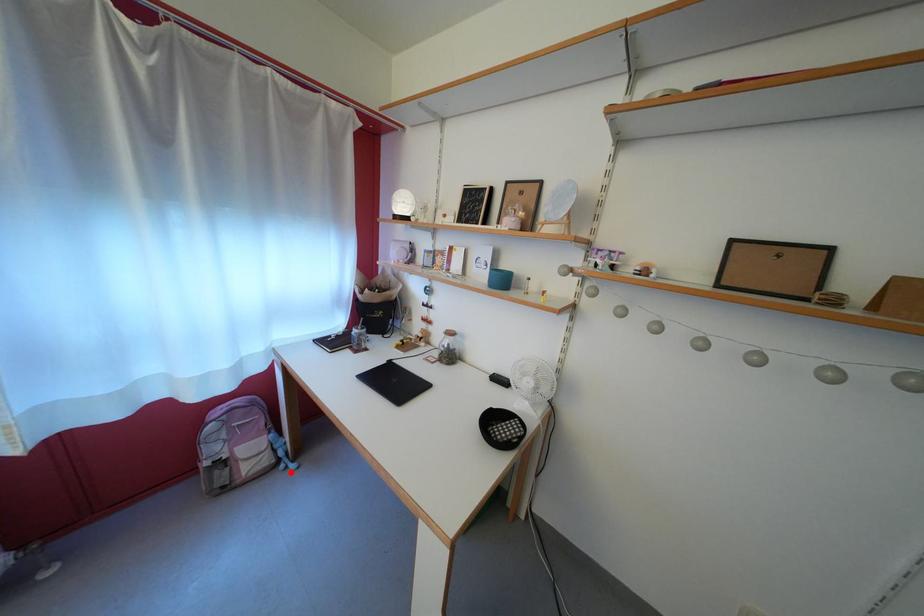
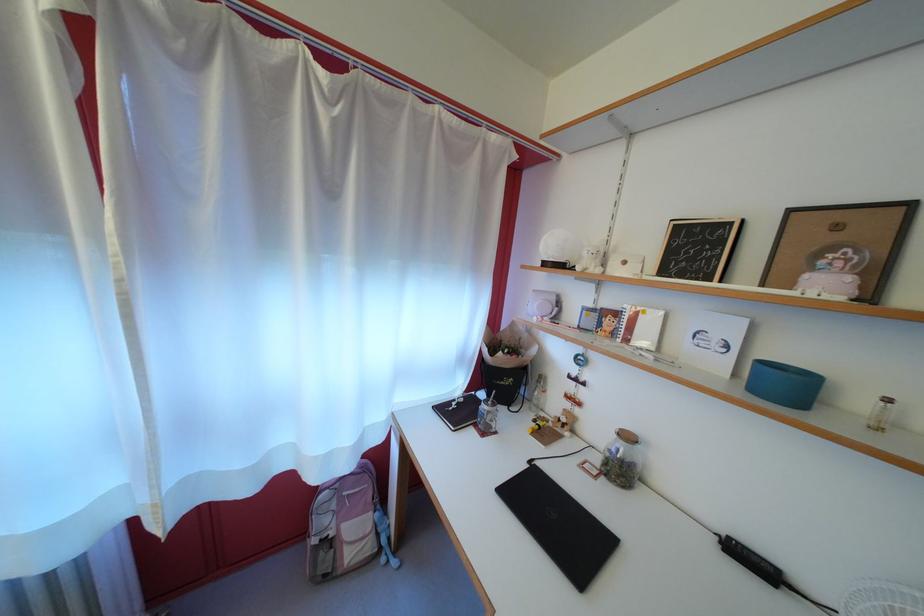
In the second image, find the point that corresponds to the highlighted location in the first image.

(392, 565)